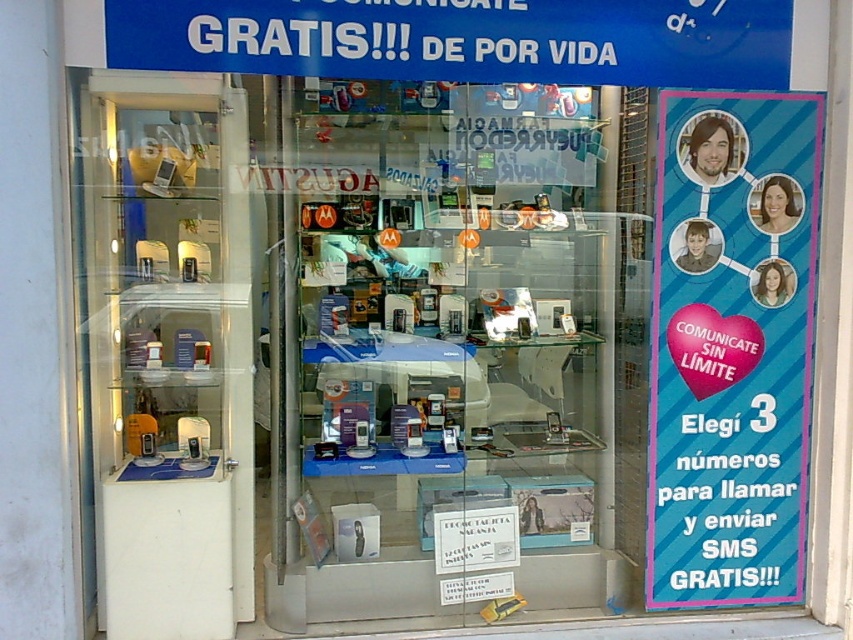
Question: Which point is farther to the camera?

Choices:
 (A) (373, 355)
 (B) (753, 433)

Answer: (A)

Question: Among these objects, which one is nearest to the camera?

Choices:
 (A) transparent glass display at center
 (B) blue striped poster at right

Answer: (B)

Question: Does transparent glass display at center appear on the left side of blue striped poster at right?

Choices:
 (A) no
 (B) yes

Answer: (B)

Question: Is transparent glass display at center positioned at the back of blue striped poster at right?

Choices:
 (A) yes
 (B) no

Answer: (A)

Question: Among these objects, which one is farthest from the camera?

Choices:
 (A) transparent glass display at center
 (B) blue striped poster at right

Answer: (A)

Question: Can you confirm if transparent glass display at center is wider than blue striped poster at right?

Choices:
 (A) no
 (B) yes

Answer: (B)